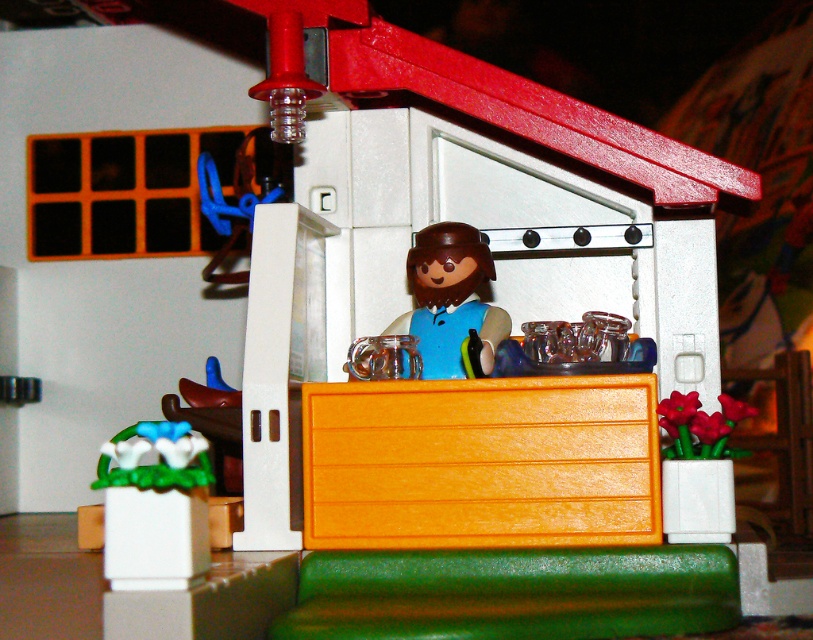
Does orange matte drawer at center appear under white glossy flower pot at lower left?

No.

Is orange matte drawer at center smaller than white glossy flower pot at lower left?

Incorrect, orange matte drawer at center is not smaller in size than white glossy flower pot at lower left.

This screenshot has width=813, height=640. Describe the element at coordinates (481, 461) in the screenshot. I see `orange matte drawer at center` at that location.

You are a GUI agent. You are given a task and a screenshot of the screen. Output one action in this format:
    pyautogui.click(x=<x>, y=<y>)
    Task: Click on the orange matte drawer at center
    
    Given the screenshot: What is the action you would take?
    pyautogui.click(x=481, y=461)